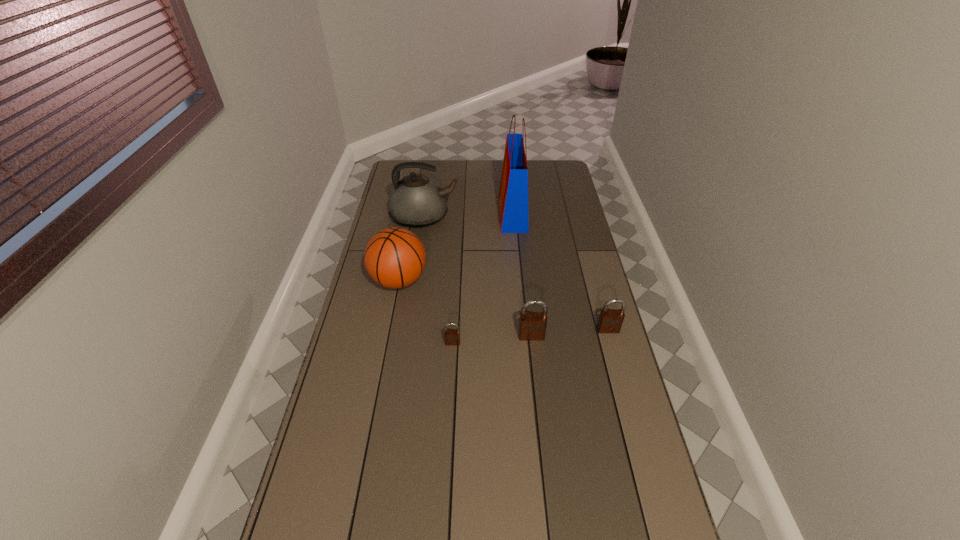
Please point out where to position a new padlock on the left to maintain spacing. Please provide its 2D coordinates. Your answer should be formatted as a tuple, i.e. [(x, y)], where the tuple contains the x and y coordinates of a point satisfying the conditions above.

[(372, 350)]